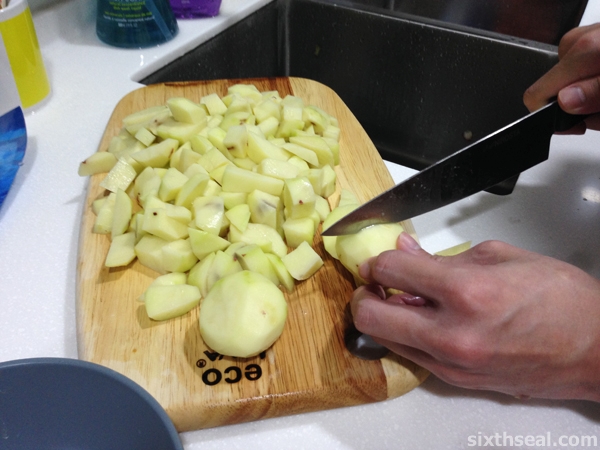
Identify the location of double-sided sink. The image size is (600, 450). (473, 62), (523, 27).